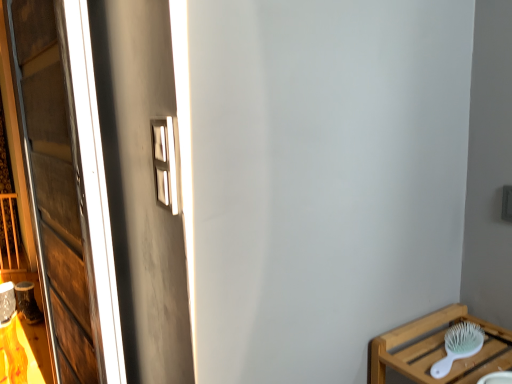
Question: Can you confirm if white plastic brush at lower right is shorter than wooden window at left?

Choices:
 (A) yes
 (B) no

Answer: (A)

Question: Can wooden window at left be found inside white plastic brush at lower right?

Choices:
 (A) yes
 (B) no

Answer: (B)

Question: Is white plastic brush at lower right oriented away from wooden window at left?

Choices:
 (A) no
 (B) yes

Answer: (A)

Question: Can you confirm if white plastic brush at lower right is thinner than wooden window at left?

Choices:
 (A) yes
 (B) no

Answer: (B)

Question: From the image's perspective, is white plastic brush at lower right on wooden window at left?

Choices:
 (A) yes
 (B) no

Answer: (B)

Question: Is white plastic brush at lower right positioned far away from wooden window at left?

Choices:
 (A) no
 (B) yes

Answer: (B)

Question: Can you confirm if wooden window at left is shorter than white plastic brush at lower right?

Choices:
 (A) yes
 (B) no

Answer: (B)

Question: Are wooden window at left and white plastic brush at lower right beside each other?

Choices:
 (A) no
 (B) yes

Answer: (A)

Question: From a real-world perspective, is wooden window at left beneath white plastic brush at lower right?

Choices:
 (A) yes
 (B) no

Answer: (B)

Question: Considering the relative sizes of wooden window at left and white plastic brush at lower right in the image provided, is wooden window at left taller than white plastic brush at lower right?

Choices:
 (A) yes
 (B) no

Answer: (A)

Question: From the image's perspective, would you say wooden window at left is positioned over white plastic brush at lower right?

Choices:
 (A) yes
 (B) no

Answer: (A)

Question: Is wooden window at left to the right of white plastic brush at lower right from the viewer's perspective?

Choices:
 (A) no
 (B) yes

Answer: (A)

Question: From their relative heights in the image, would you say wooden window at left is taller or shorter than white plastic brush at lower right?

Choices:
 (A) tall
 (B) short

Answer: (A)